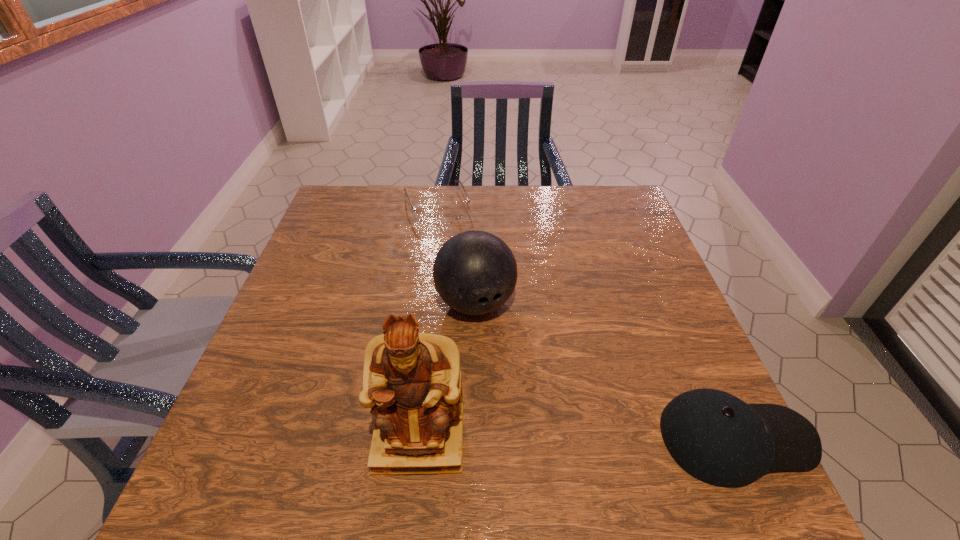
Where is `vacant area situated on the grip area of the third shortest object`? vacant area situated on the grip area of the third shortest object is located at coordinates (499, 347).

Locate an element on the screen. vacant point located on the grip area of the third shortest object is located at coordinates (548, 440).

Where is `vacant space situated 0.210m on the grip area of the third shortest object`? The height and width of the screenshot is (540, 960). vacant space situated 0.210m on the grip area of the third shortest object is located at coordinates (532, 408).

Locate an element on the screen. The image size is (960, 540). object at the far edge is located at coordinates (429, 214).

Where is `figurine that is at the near edge`? The width and height of the screenshot is (960, 540). figurine that is at the near edge is located at coordinates (412, 382).

Locate an element on the screen. baseball cap located at the near edge is located at coordinates (717, 438).

The width and height of the screenshot is (960, 540). What are the coordinates of `object that is positioned at the right edge` in the screenshot? It's located at (717, 438).

I want to click on object that is at the near right corner, so click(x=717, y=438).

You are a GUI agent. You are given a task and a screenshot of the screen. Output one action in this format:
    pyautogui.click(x=<x>, y=<y>)
    Task: Click on the vacant space at the far edge of the desktop
    This screenshot has width=960, height=540.
    Given the screenshot: What is the action you would take?
    pyautogui.click(x=458, y=197)

The height and width of the screenshot is (540, 960). Identify the location of vacant space at the near edge of the desktop. (332, 420).